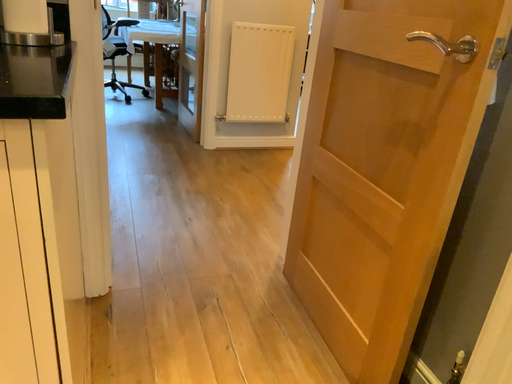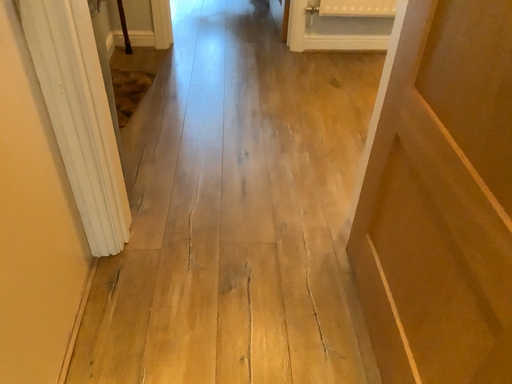
Question: How did the camera likely rotate when shooting the video?

Choices:
 (A) rotated upward
 (B) rotated downward

Answer: (B)